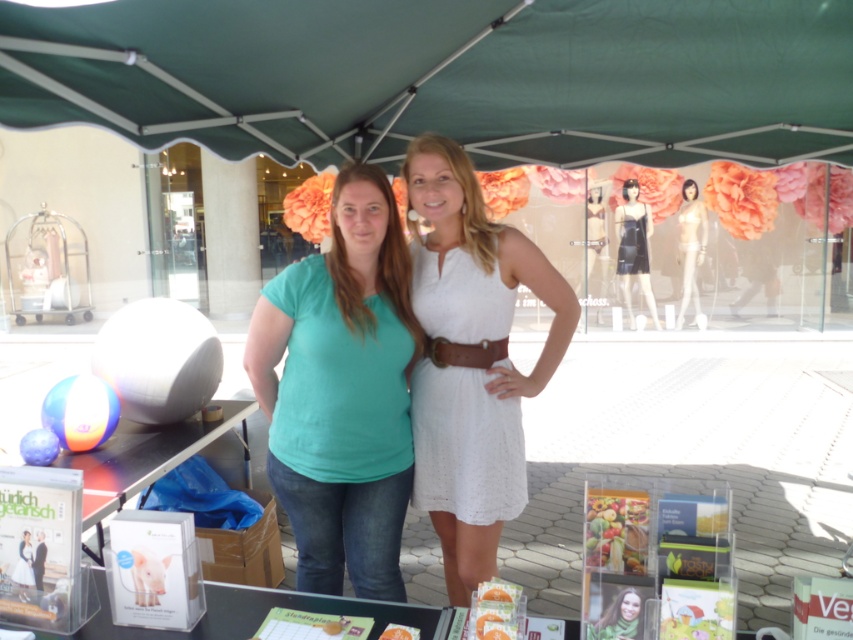
You are a customer at an outdoor market and see the black satin dress at upper center and the brown leather belt at center. Which item is positioned more to the right?

The black satin dress at upper center is positioned more to the right than the brown leather belt at center.

You are a photographer trying to capture a clear shot of both the green fabric canopy at upper center and the white lace dress at center. Since you want to focus on the canopy first, which object should you adjust your camera focus on first and why?

The green fabric canopy at upper center has a larger size compared to the white lace dress at center, so you should focus on the green fabric canopy at upper center first because it takes up more space in the frame and requires proper focus to capture its details.